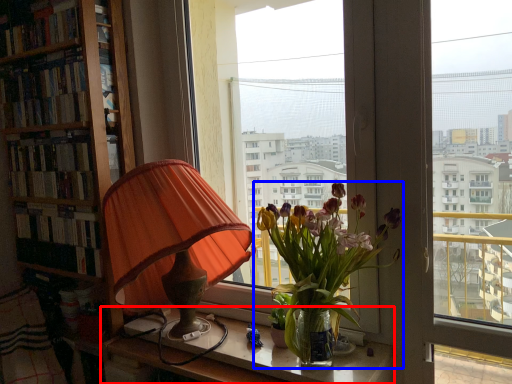
Question: Which object appears closest to the camera in this image, table (highlighted by a red box) or houseplant (highlighted by a blue box)?

Choices:
 (A) table
 (B) houseplant

Answer: (B)